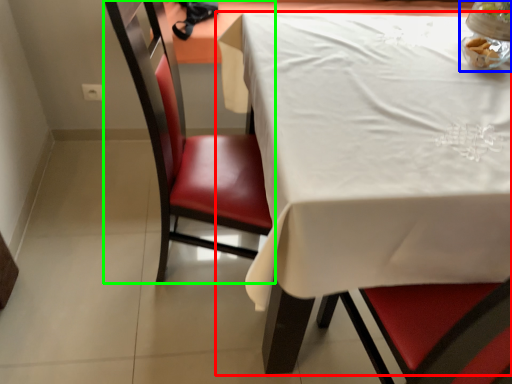
Question: Which is farther away from table (highlighted by a red box)? tableware (highlighted by a blue box) or chair (highlighted by a green box)?

Choices:
 (A) tableware
 (B) chair

Answer: (A)